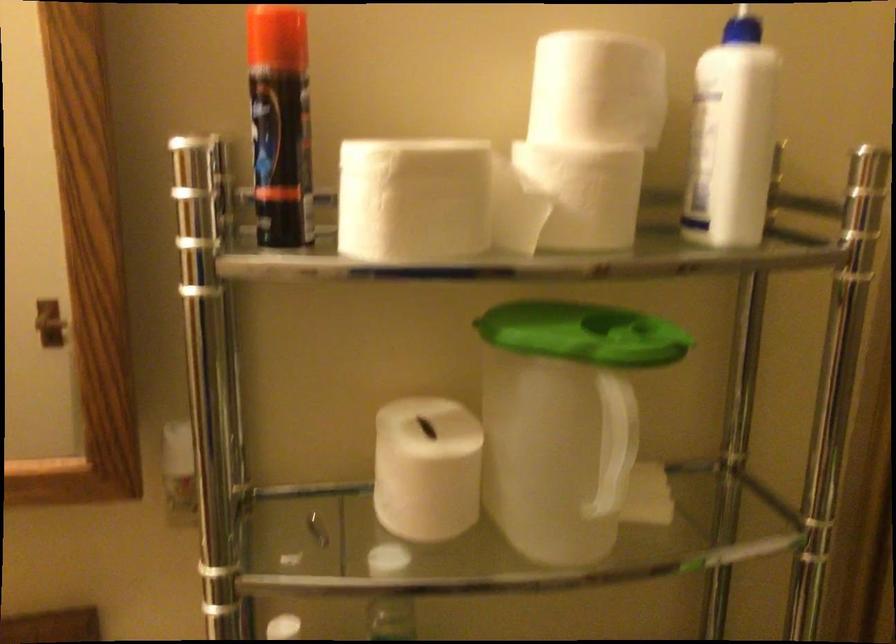
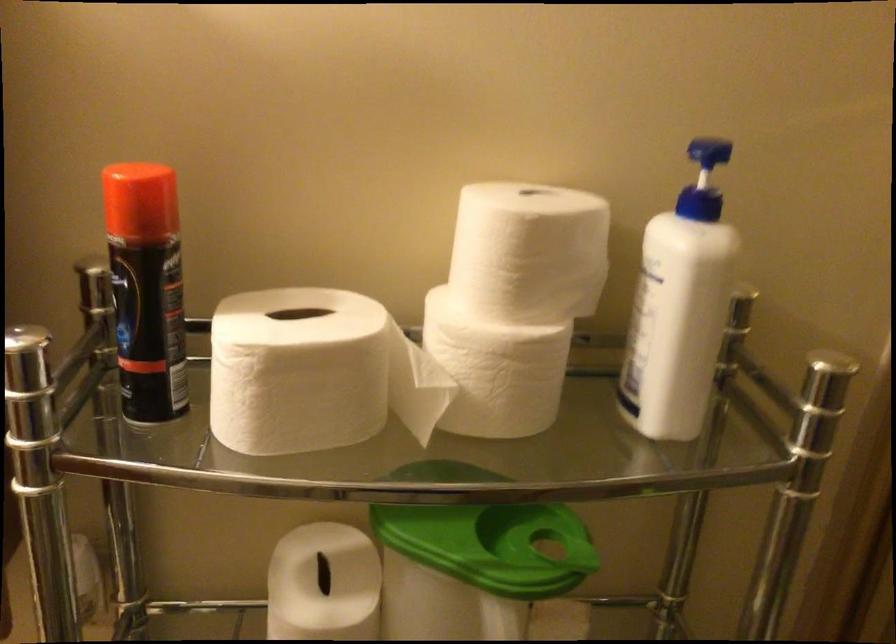
Question: Based on the continuous images, in which direction is the camera rotating? Reply with the corresponding letter.

Choices:
 (A) Left
 (B) Right
 (C) Up
 (D) Down

Answer: (D)